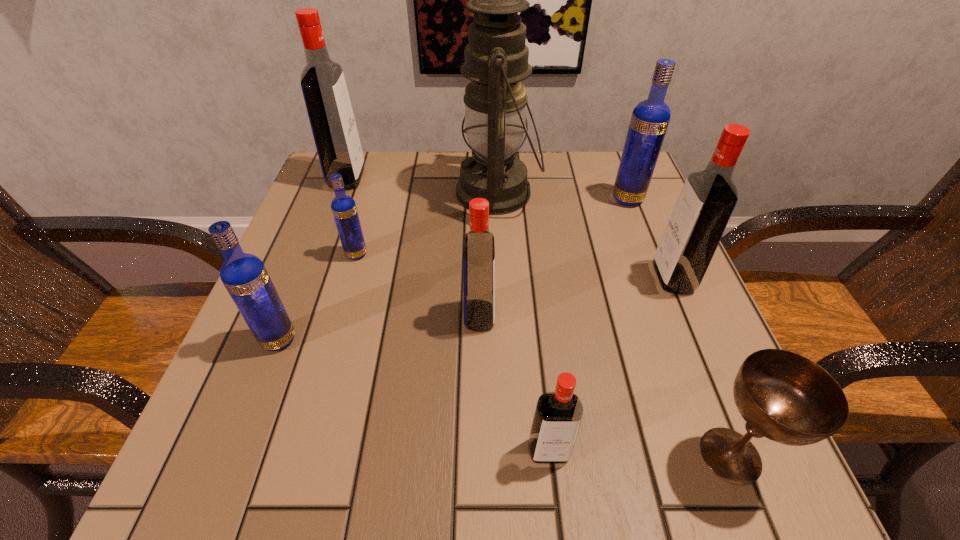
Where is `object located in the far left corner section of the desktop`? object located in the far left corner section of the desktop is located at coordinates (x=323, y=84).

The width and height of the screenshot is (960, 540). In order to click on object present at the far right corner in this screenshot , I will do `click(650, 118)`.

This screenshot has width=960, height=540. Find the location of `object located in the near right corner section of the desktop`. object located in the near right corner section of the desktop is located at coordinates (783, 396).

The width and height of the screenshot is (960, 540). I want to click on vacant space at the far edge, so click(x=565, y=192).

This screenshot has height=540, width=960. I want to click on vacant space at the near edge of the desktop, so click(372, 483).

In the image, there is a desktop. Where is `vacant space at the left edge`? This screenshot has height=540, width=960. vacant space at the left edge is located at coordinates (330, 287).

Identify the location of vacant area at the right edge of the desktop. The image size is (960, 540). (634, 341).

Where is `free space at the near left corner of the desktop`? The width and height of the screenshot is (960, 540). free space at the near left corner of the desktop is located at coordinates (289, 433).

Image resolution: width=960 pixels, height=540 pixels. What are the coordinates of `blank space at the near right corner` in the screenshot? It's located at (658, 448).

Identify the location of free space between the third object from left to right and the oil lamp. (427, 223).